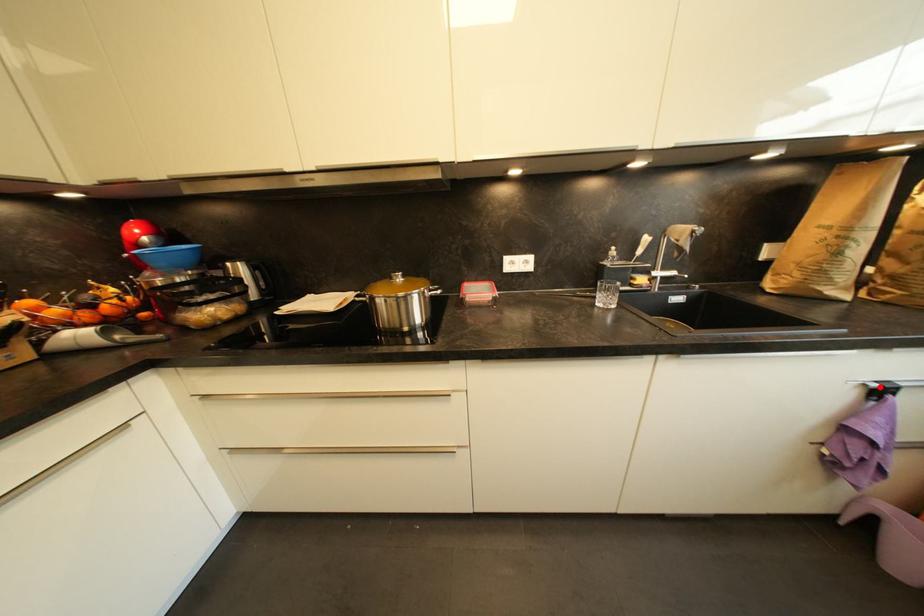
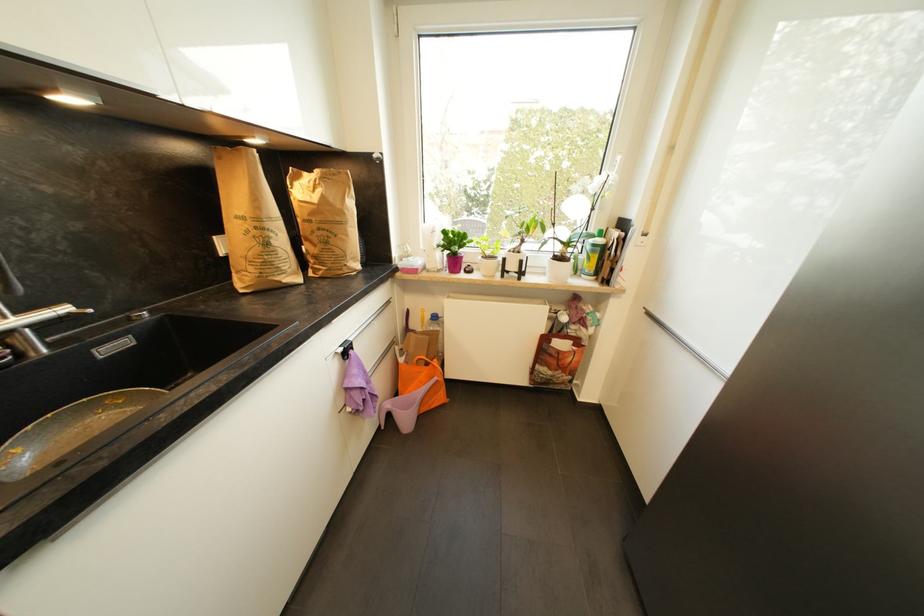
Locate, in the second image, the point that corresponds to the highlighted location in the first image.

(346, 351)